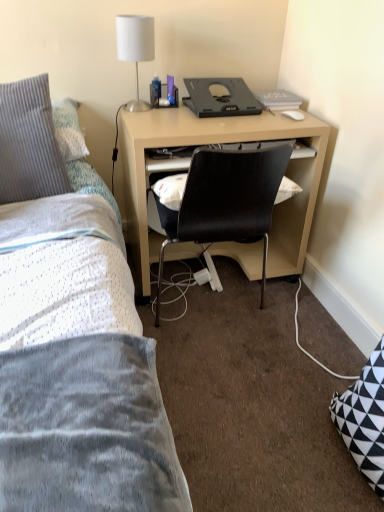
Question: Can you confirm if matte wood computer desk at center is shorter than white fabric lampshade at upper center?

Choices:
 (A) yes
 (B) no

Answer: (B)

Question: From the image's perspective, is matte wood computer desk at center over white fabric lampshade at upper center?

Choices:
 (A) yes
 (B) no

Answer: (B)

Question: Is there a large distance between matte wood computer desk at center and white fabric lampshade at upper center?

Choices:
 (A) yes
 (B) no

Answer: (B)

Question: Considering the relative sizes of matte wood computer desk at center and white fabric lampshade at upper center in the image provided, is matte wood computer desk at center smaller than white fabric lampshade at upper center?

Choices:
 (A) yes
 (B) no

Answer: (B)

Question: Can you confirm if matte wood computer desk at center is bigger than white fabric lampshade at upper center?

Choices:
 (A) yes
 (B) no

Answer: (A)

Question: Could you tell me if matte wood computer desk at center is turned towards white fabric lampshade at upper center?

Choices:
 (A) yes
 (B) no

Answer: (B)

Question: From a real-world perspective, does gray ribbed pillow at upper left stand above white fabric lampshade at upper center?

Choices:
 (A) no
 (B) yes

Answer: (A)

Question: Can you confirm if gray ribbed pillow at upper left is bigger than white fabric lampshade at upper center?

Choices:
 (A) yes
 (B) no

Answer: (A)

Question: Is white fabric lampshade at upper center surrounded by gray ribbed pillow at upper left?

Choices:
 (A) yes
 (B) no

Answer: (B)

Question: Can you confirm if gray ribbed pillow at upper left is thinner than white fabric lampshade at upper center?

Choices:
 (A) no
 (B) yes

Answer: (A)

Question: From a real-world perspective, is gray ribbed pillow at upper left under white fabric lampshade at upper center?

Choices:
 (A) no
 (B) yes

Answer: (B)

Question: Is gray ribbed pillow at upper left not close to white fabric lampshade at upper center?

Choices:
 (A) yes
 (B) no

Answer: (B)

Question: Is black plastic desktop at center to the left of gray ribbed pillow at upper left from the viewer's perspective?

Choices:
 (A) yes
 (B) no

Answer: (B)